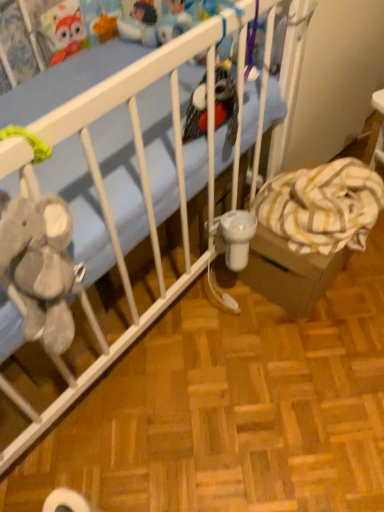
Question: Would you say striped fabric cardboard box at lower right is to the left or to the right of matte plastic toy at upper center, arranged as the first toy when viewed from the back, in the picture?

Choices:
 (A) right
 (B) left

Answer: (A)

Question: Considering the positions of striped fabric cardboard box at lower right and matte plastic toy at upper center, which is counted as the first toy, starting from the left, in the image, is striped fabric cardboard box at lower right wider or thinner than matte plastic toy at upper center, which is counted as the first toy, starting from the left,?

Choices:
 (A) wide
 (B) thin

Answer: (A)

Question: Considering the real-world distances, which object is farthest from the matte plastic toy at upper center, which is counted as the first toy, starting from the left?

Choices:
 (A) striped fabric cardboard box at lower right
 (B) yellow striped blanket at lower right
 (C) velvety plush bird at center, the 2th toy viewed from the top
 (D) blue fabric crib at upper left

Answer: (A)

Question: Which object is positioned closest to the velvety plush bird at center, the second toy from the left?

Choices:
 (A) matte plastic toy at upper center, which appears as the 1th toy when viewed from the top
 (B) striped fabric cardboard box at lower right
 (C) blue fabric crib at upper left
 (D) yellow striped blanket at lower right

Answer: (C)